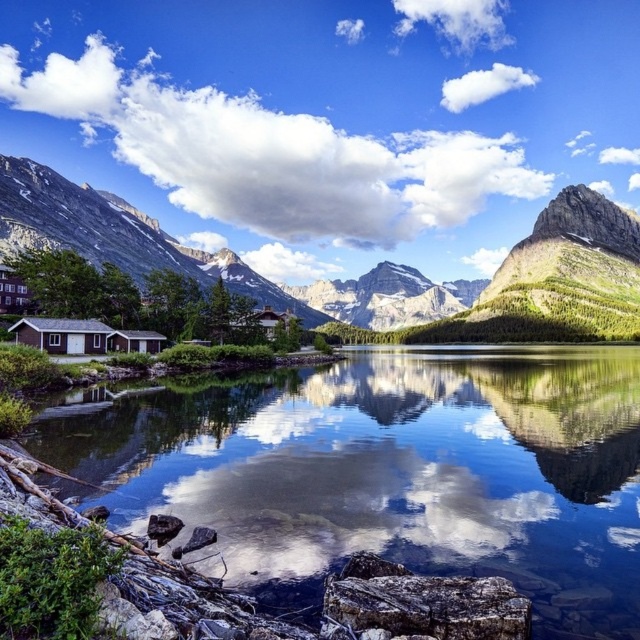
Question: Can you confirm if clear glass water at center is positioned to the left of green grassy mountain at center?

Choices:
 (A) no
 (B) yes

Answer: (A)

Question: Among these objects, which one is farthest from the camera?

Choices:
 (A) green grassy mountain at center
 (B) clear glass water at center

Answer: (A)

Question: Does clear glass water at center lie in front of green grassy mountain at center?

Choices:
 (A) no
 (B) yes

Answer: (B)

Question: Does clear glass water at center have a smaller size compared to green grassy mountain at center?

Choices:
 (A) no
 (B) yes

Answer: (B)